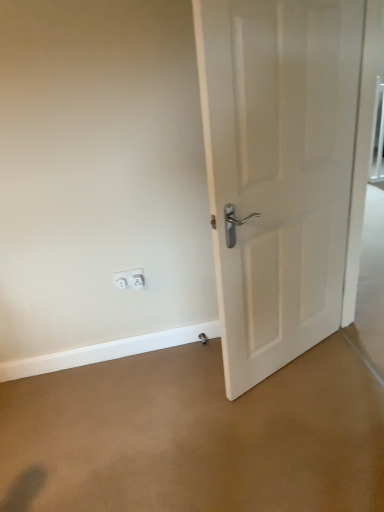
Question: Is white plastic electric outlet at lower left, the 2th electric outlet viewed from the right, bigger than white matte door at right?

Choices:
 (A) no
 (B) yes

Answer: (A)

Question: Is white plastic electric outlet at lower left, arranged as the 1th electric outlet when viewed from the left, not inside white matte door at right?

Choices:
 (A) yes
 (B) no

Answer: (A)

Question: Is the depth of white plastic electric outlet at lower left, arranged as the 1th electric outlet when viewed from the left, less than that of white matte door at right?

Choices:
 (A) no
 (B) yes

Answer: (A)

Question: From the image's perspective, is white plastic electric outlet at lower left, arranged as the 1th electric outlet when viewed from the left, located beneath white matte door at right?

Choices:
 (A) no
 (B) yes

Answer: (B)

Question: From a real-world perspective, is white plastic electric outlet at lower left, the 2th electric outlet viewed from the right, located beneath white matte door at right?

Choices:
 (A) no
 (B) yes

Answer: (B)

Question: Would you say white plastic electric outlet at lower left, the 2th electric outlet viewed from the right, is inside or outside white matte door at right?

Choices:
 (A) inside
 (B) outside

Answer: (B)

Question: Is point [x=132, y=269] closer or farther from the camera than point [x=246, y=214]?

Choices:
 (A) farther
 (B) closer

Answer: (A)

Question: From the image's perspective, is white plastic electric outlet at lower left, arranged as the 1th electric outlet when viewed from the left, positioned above or below white matte door at right?

Choices:
 (A) above
 (B) below

Answer: (B)

Question: Is white plastic electric outlet at lower left, arranged as the 1th electric outlet when viewed from the left, taller or shorter than white matte door at right?

Choices:
 (A) tall
 (B) short

Answer: (B)

Question: From the image's perspective, is brown carpet at center positioned above or below white plastic electric outlet at lower left, placed as the 2th electric outlet when sorted from left to right?

Choices:
 (A) below
 (B) above

Answer: (A)

Question: Visually, is brown carpet at center positioned to the left or to the right of white plastic electric outlet at lower left, placed as the 2th electric outlet when sorted from left to right?

Choices:
 (A) left
 (B) right

Answer: (B)

Question: Considering their positions, is brown carpet at center located in front of or behind white plastic electric outlet at lower left, the 1th electric outlet from the right?

Choices:
 (A) front
 (B) behind

Answer: (A)

Question: Considering the positions of brown carpet at center and white plastic electric outlet at lower left, the 1th electric outlet from the right, in the image, is brown carpet at center bigger or smaller than white plastic electric outlet at lower left, the 1th electric outlet from the right,?

Choices:
 (A) small
 (B) big

Answer: (B)

Question: Is point (165, 373) closer or farther from the camera than point (134, 287)?

Choices:
 (A) closer
 (B) farther

Answer: (A)

Question: Is brown carpet at center taller or shorter than white plastic electric outlet at lower left, the 2th electric outlet viewed from the right?

Choices:
 (A) tall
 (B) short

Answer: (B)